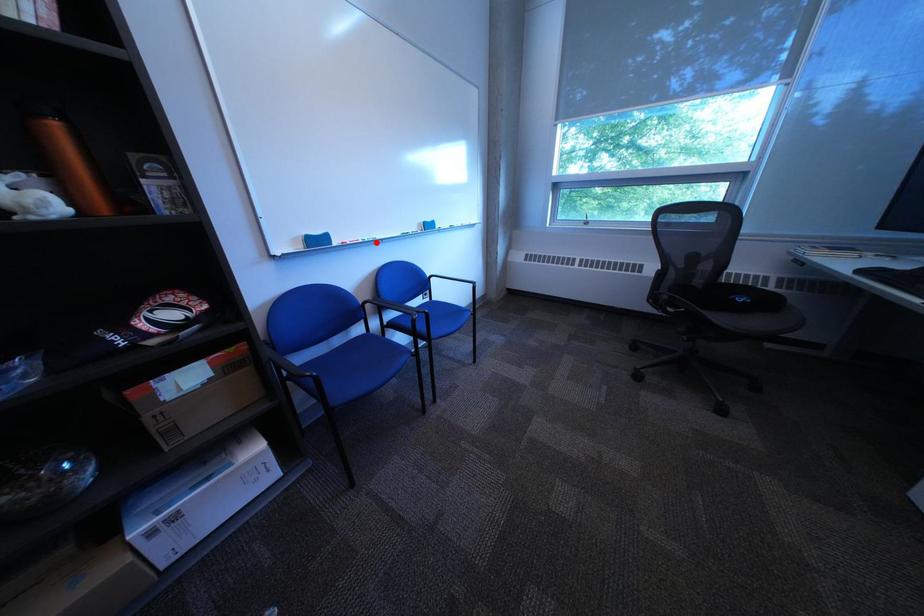
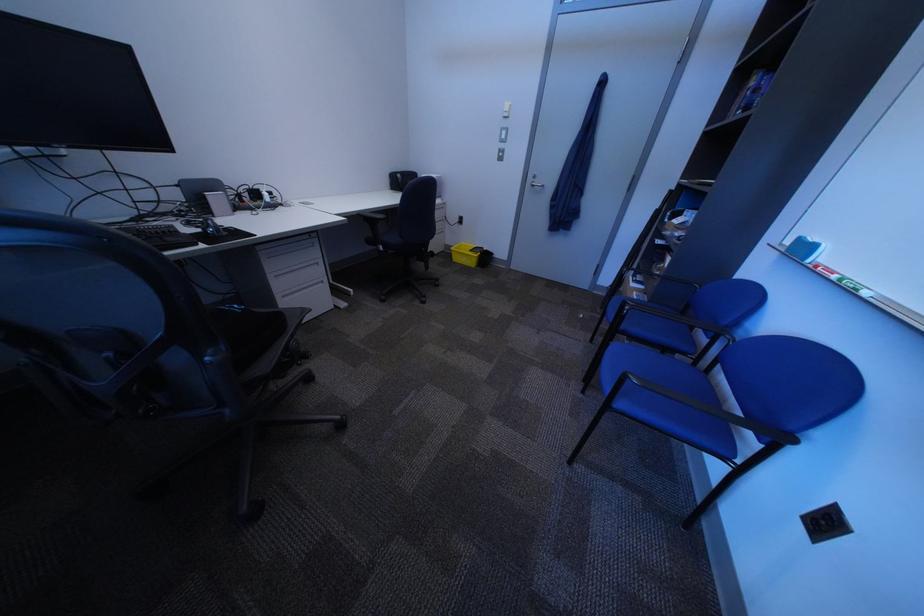
Question: A red point is marked in image1. In image2, is the corresponding 3D point closer to the camera or farther? Reply with the corresponding letter.

Choices:
 (A) The corresponding 3D point is closer.
 (B) The corresponding 3D point is farther.

Answer: (B)